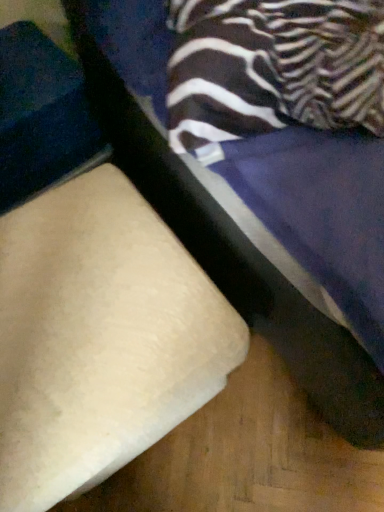
Question: In terms of width, does beige fabric cushion at lower left, which ranks as the second furniture in right-to-left order, look wider or thinner when compared to beige fabric ottoman at lower left, the first furniture in the right-to-left sequence?

Choices:
 (A) wide
 (B) thin

Answer: (B)

Question: From the image's perspective, is beige fabric cushion at lower left, which ranks as the second furniture in right-to-left order, located above or below beige fabric ottoman at lower left, which appears as the 2th furniture when viewed from the left?

Choices:
 (A) below
 (B) above

Answer: (A)

Question: Considering their positions, is beige fabric cushion at lower left, which ranks as the second furniture in right-to-left order, located in front of or behind beige fabric ottoman at lower left, the first furniture in the right-to-left sequence?

Choices:
 (A) front
 (B) behind

Answer: (B)

Question: Is beige fabric ottoman at lower left, which appears as the 2th furniture when viewed from the left, to the left or to the right of beige fabric cushion at lower left, which is the 1th furniture in left-to-right order, in the image?

Choices:
 (A) left
 (B) right

Answer: (B)

Question: Is beige fabric ottoman at lower left, the first furniture in the right-to-left sequence, bigger or smaller than beige fabric cushion at lower left, which ranks as the second furniture in right-to-left order?

Choices:
 (A) small
 (B) big

Answer: (B)

Question: From their relative heights in the image, would you say beige fabric ottoman at lower left, which appears as the 2th furniture when viewed from the left, is taller or shorter than beige fabric cushion at lower left, which ranks as the second furniture in right-to-left order?

Choices:
 (A) tall
 (B) short

Answer: (A)

Question: Choose the correct answer: Is beige fabric ottoman at lower left, the first furniture in the right-to-left sequence, inside beige fabric cushion at lower left, which ranks as the second furniture in right-to-left order, or outside it?

Choices:
 (A) inside
 (B) outside

Answer: (B)